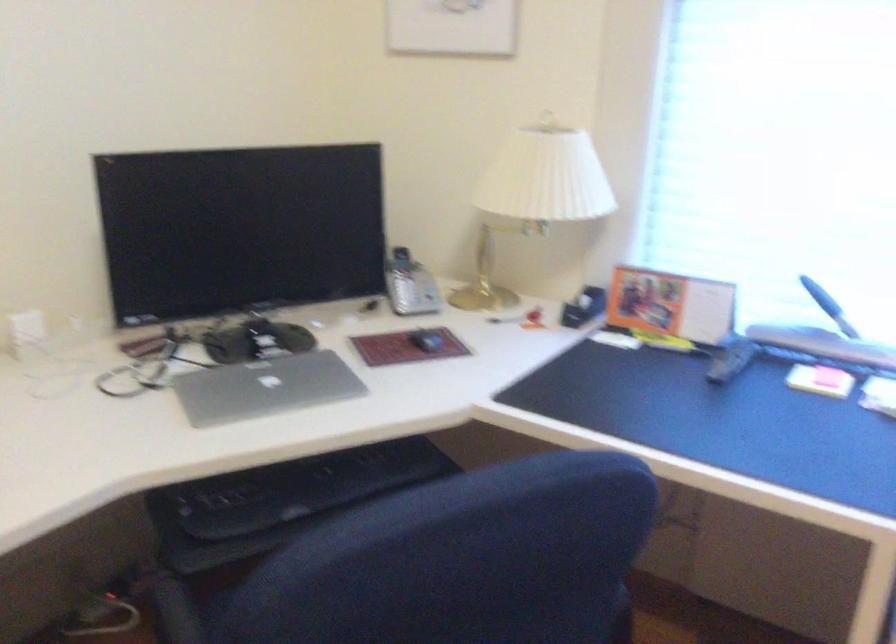
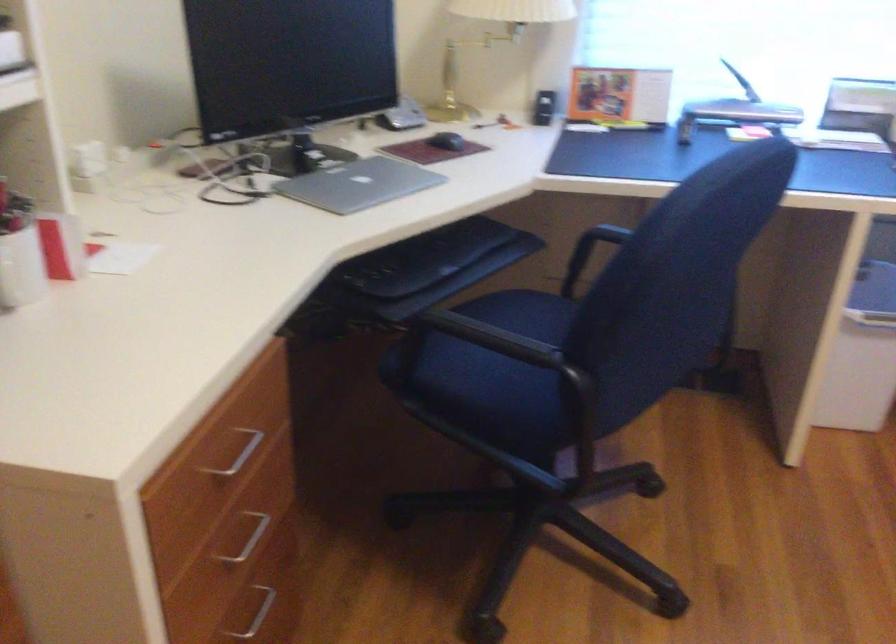
Locate, in the second image, the point that corresponds to the point at 294,488 in the first image.

(425, 258)